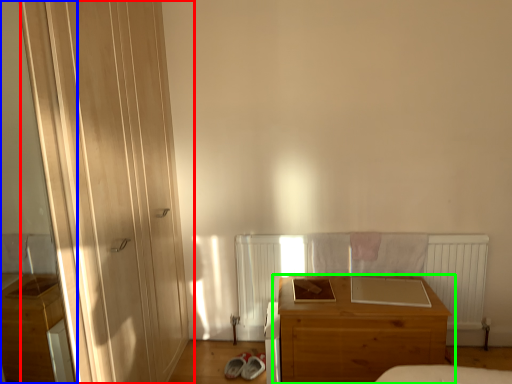
Question: Which object is the farthest from door (highlighted by a red box)? Choose among these: screen door (highlighted by a blue box) or chest of drawers (highlighted by a green box).

Choices:
 (A) screen door
 (B) chest of drawers

Answer: (A)